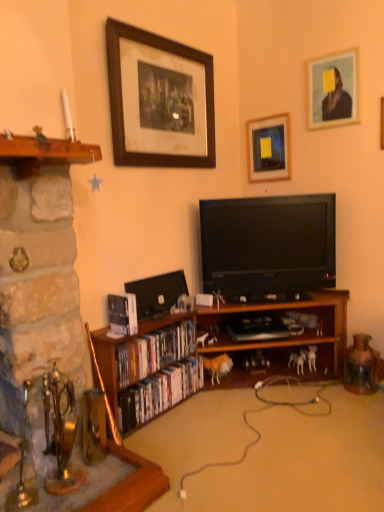
Find the location of a particular element. vacant space in front of white plastic dog at lower right, the first animal positioned from the right is located at coordinates 305,389.